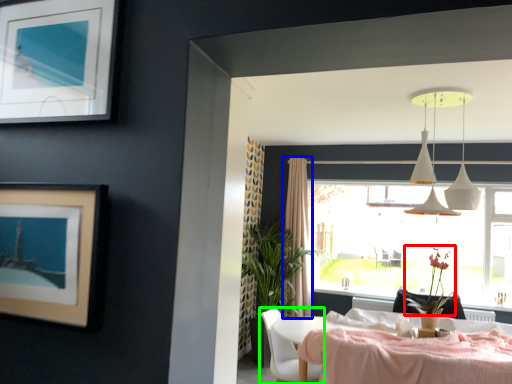
Question: Which object is the farthest from flower (highlighted by a red box)? Choose among these: curtain (highlighted by a blue box) or chair (highlighted by a green box).

Choices:
 (A) curtain
 (B) chair

Answer: (A)